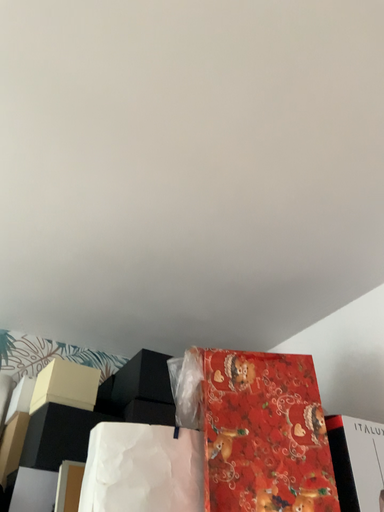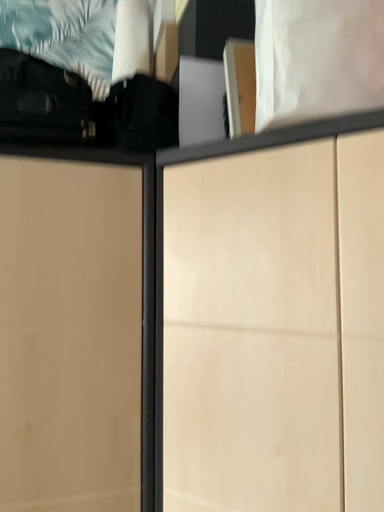
Question: How did the camera likely rotate when shooting the video?

Choices:
 (A) rotated right
 (B) rotated left

Answer: (B)